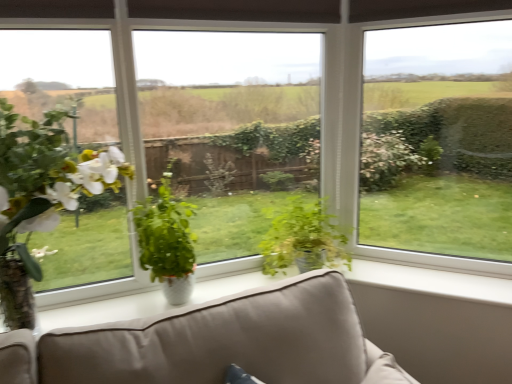
This screenshot has height=384, width=512. I want to click on vacant area on top of transparent glass window at center (from a real-world perspective), so click(x=264, y=1).